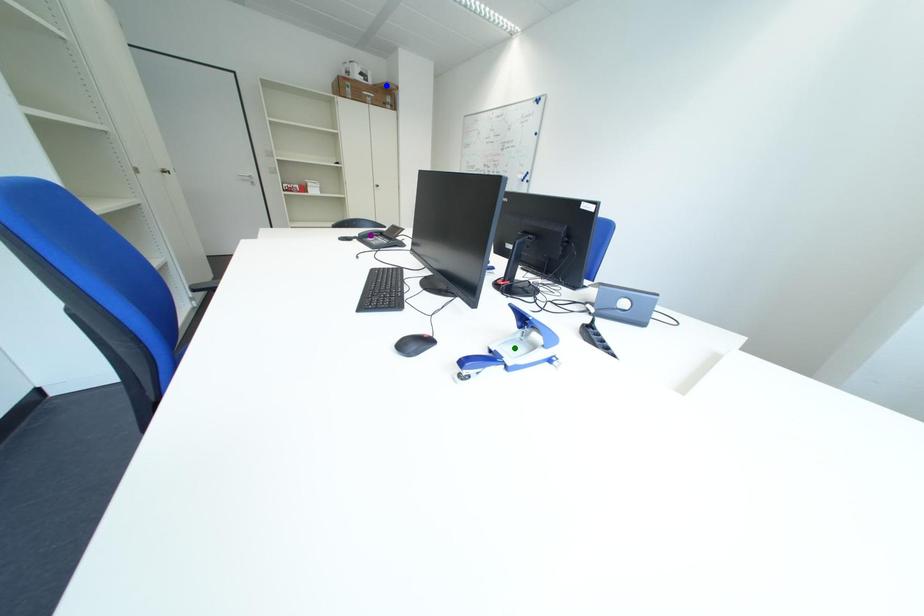
Order these from nearest to farthest:
blue point
purple point
green point

green point < purple point < blue point